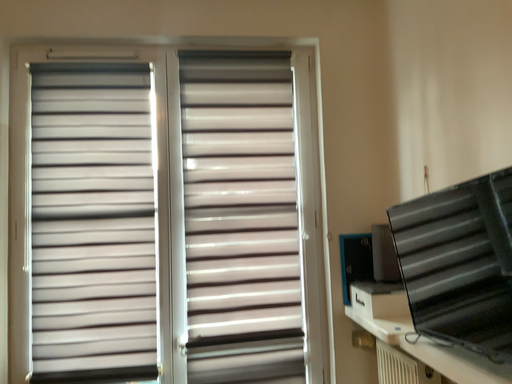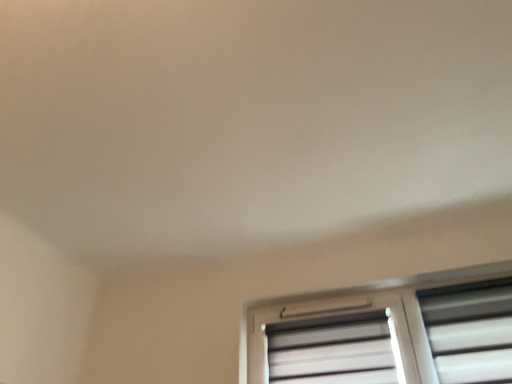
Question: How did the camera likely rotate when shooting the video?

Choices:
 (A) rotated downward
 (B) rotated upward

Answer: (B)